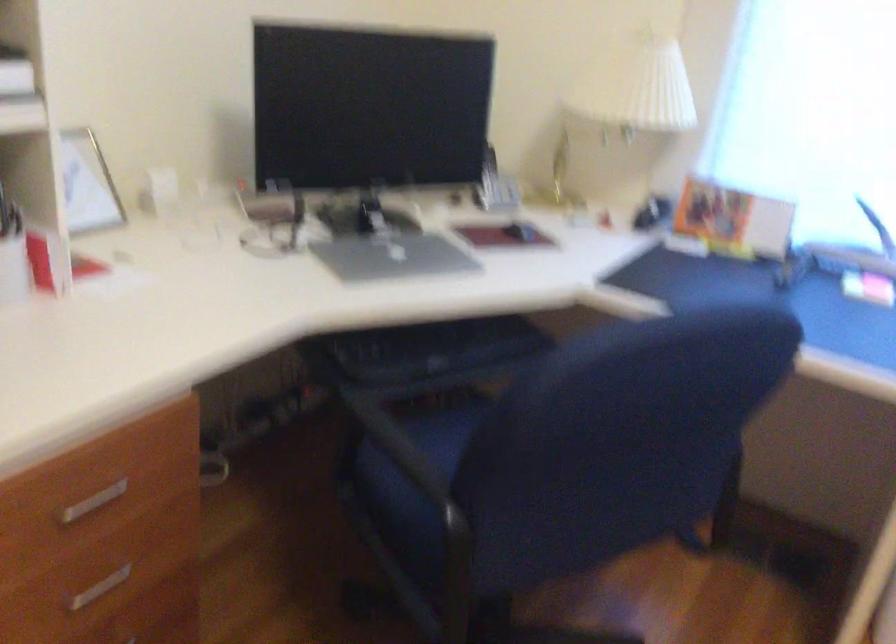
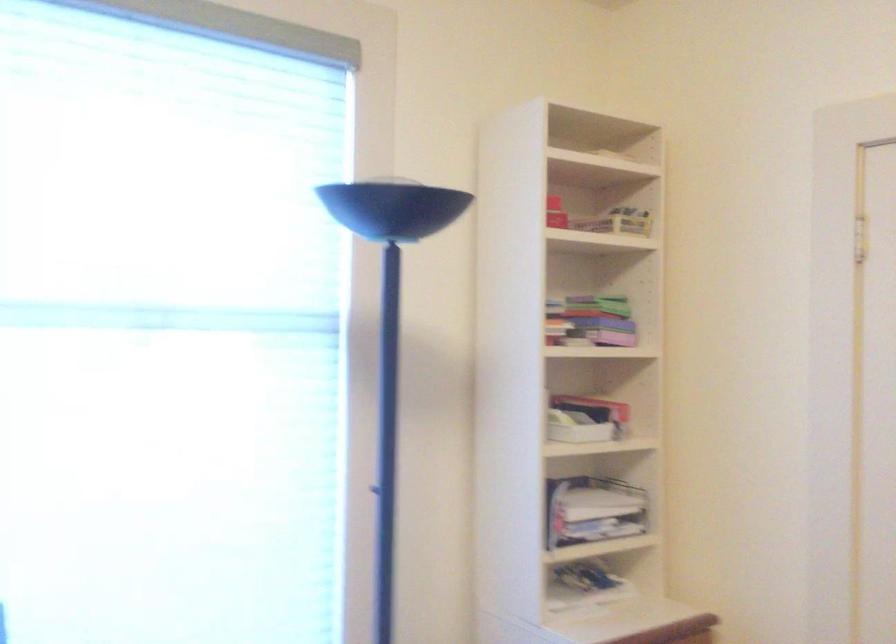
Question: How did the camera likely rotate?

Choices:
 (A) Left
 (B) Right
 (C) Up
 (D) Down

Answer: (B)